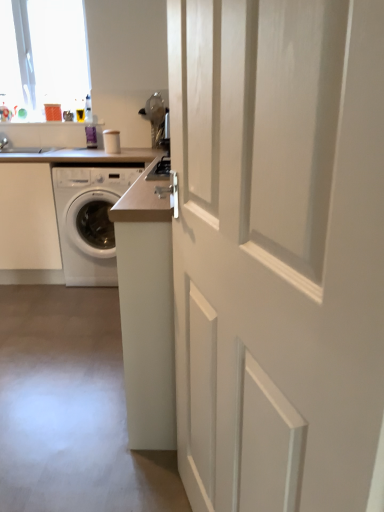
Identify the location of transparent glass window at upper left. This screenshot has height=512, width=384. (43, 52).

This screenshot has width=384, height=512. Identify the location of white glossy washing machine at left. (89, 221).

Describe the element at coordinates (278, 250) in the screenshot. Image resolution: width=384 pixels, height=512 pixels. I see `white glossy door at center` at that location.

The image size is (384, 512). What are the coordinates of `white glossy washing machine at left` in the screenshot? It's located at (40, 211).

Is white glossy door at center situated inside white glossy washing machine at left or outside?

white glossy door at center lies outside white glossy washing machine at left.

Looking at the image, does white glossy door at center seem bigger or smaller compared to white glossy washing machine at left?

Clearly, white glossy door at center is smaller in size than white glossy washing machine at left.

Can you confirm if white glossy door at center is positioned to the right of white glossy washing machine at left?

Correct, you'll find white glossy door at center to the right of white glossy washing machine at left.

At what (x,y) coordinates should I click in order to perform the action: click on door that appears above the white glossy washing machine at left (from a real-world perspective). Please return your answer as a coordinate pair (x, y). Image resolution: width=384 pixels, height=512 pixels. Looking at the image, I should click on (278, 250).

Is white glossy washing machine at left oriented away from white laminate counter at center?

No, white laminate counter at center is not at the back of white glossy washing machine at left.

Considering the positions of objects white glossy washing machine at left and white laminate counter at center in the image provided, who is more to the left, white glossy washing machine at left or white laminate counter at center?

Positioned to the left is white glossy washing machine at left.

Which point is more forward, (6, 273) or (117, 250)?

The point (117, 250) is in front.

The height and width of the screenshot is (512, 384). I want to click on window behind the white glossy washing machine at left, so click(43, 52).

Is white glossy washing machine at left located outside transparent glass window at upper left?

white glossy washing machine at left lies outside transparent glass window at upper left's area.

Considering the relative sizes of white glossy washing machine at left and transparent glass window at upper left in the image provided, is white glossy washing machine at left taller than transparent glass window at upper left?

Correct, white glossy washing machine at left is much taller as transparent glass window at upper left.

Is white laminate counter at center wider or thinner than transparent glass window at upper left?

In the image, white laminate counter at center appears to be wider than transparent glass window at upper left.

This screenshot has height=512, width=384. Identify the location of window located behind the white laminate counter at center. (43, 52).

Is white laminate counter at center bigger than transparent glass window at upper left?

Yes.

Between white laminate counter at center and white glossy washing machine at left, which one appears on the right side from the viewer's perspective?

white laminate counter at center is more to the right.

Between white laminate counter at center and white glossy washing machine at left, which one is positioned behind?

white glossy washing machine at left is further away from the camera.

Are white laminate counter at center and white glossy washing machine at left located far from each other?

Yes.

Considering the positions of point (144, 404) and point (27, 270), is point (144, 404) closer or farther from the camera than point (27, 270)?

Point (144, 404) is positioned closer to the camera compared to point (27, 270).

You are a GUI agent. You are given a task and a screenshot of the screen. Output one action in this format:
    pyautogui.click(x=<x>, y=<y>)
    Task: Click on the window on the left side of white glossy door at center
    The height and width of the screenshot is (512, 384).
    Given the screenshot: What is the action you would take?
    pyautogui.click(x=43, y=52)

Is transparent glass window at upper left not close to white glossy door at center?

Yes, transparent glass window at upper left and white glossy door at center are located far from each other.

Considering the sizes of objects transparent glass window at upper left and white glossy door at center in the image provided, who is taller, transparent glass window at upper left or white glossy door at center?

white glossy door at center.

Is transparent glass window at upper left oriented away from white glossy door at center?

transparent glass window at upper left does not have its back to white glossy door at center.

In order to click on door on the right side of white laminate counter at center in this screenshot , I will do [278, 250].

Are white glossy door at center and white laminate counter at center located far from each other?

No, white glossy door at center is not far away from white laminate counter at center.

Is white laminate counter at center completely or partially inside white glossy door at center?

No, white glossy door at center does not contain white laminate counter at center.

Where is `door above the white glossy washing machine at left (from a real-world perspective)`? The height and width of the screenshot is (512, 384). door above the white glossy washing machine at left (from a real-world perspective) is located at coordinates (278, 250).

In the image, there is a white glossy washing machine at left. Identify the location of counter below it (from the image's perspective). [x=147, y=312].

Looking at the image, which one is located further to transparent glass window at upper left, white glossy washing machine at left or white laminate counter at center?

white laminate counter at center.

Considering their positions, is transparent glass window at upper left positioned further to white glossy washing machine at left than white glossy door at center?

Based on the image, white glossy door at center appears to be further to white glossy washing machine at left.

When comparing their distances from white glossy washing machine at left, does white glossy door at center or transparent glass window at upper left seem closer?

Among the two, transparent glass window at upper left is located nearer to white glossy washing machine at left.

Looking at the image, which one is located further to white glossy door at center, white glossy washing machine at left or white laminate counter at center?

white glossy washing machine at left lies further to white glossy door at center than the other object.

From the image, which object appears to be farther from white laminate counter at center, white glossy door at center or white glossy washing machine at left?

white glossy washing machine at left is further to white laminate counter at center.

Consider the image. Considering their positions, is white glossy washing machine at left positioned further to white glossy washing machine at left than transparent glass window at upper left?

transparent glass window at upper left lies further to white glossy washing machine at left than the other object.

Considering their positions, is white glossy washing machine at left positioned further to transparent glass window at upper left than white glossy washing machine at left?

white glossy washing machine at left is further to transparent glass window at upper left.

From the image, which object appears to be nearer to white glossy washing machine at left, white glossy washing machine at left or white glossy door at center?

white glossy washing machine at left is closer to white glossy washing machine at left.

Where is `washing machine positioned between white glossy door at center and transparent glass window at upper left from near to far`? The height and width of the screenshot is (512, 384). washing machine positioned between white glossy door at center and transparent glass window at upper left from near to far is located at coordinates tap(89, 221).

Find the location of a particular element. Image resolution: width=384 pixels, height=512 pixels. appliance located between white glossy door at center and white glossy washing machine at left in the depth direction is located at coordinates (40, 211).

The image size is (384, 512). In order to click on counter positioned between white glossy door at center and white glossy washing machine at left from near to far in this screenshot , I will do `click(147, 312)`.

I want to click on counter between white glossy door at center and transparent glass window at upper left from front to back, so click(x=147, y=312).